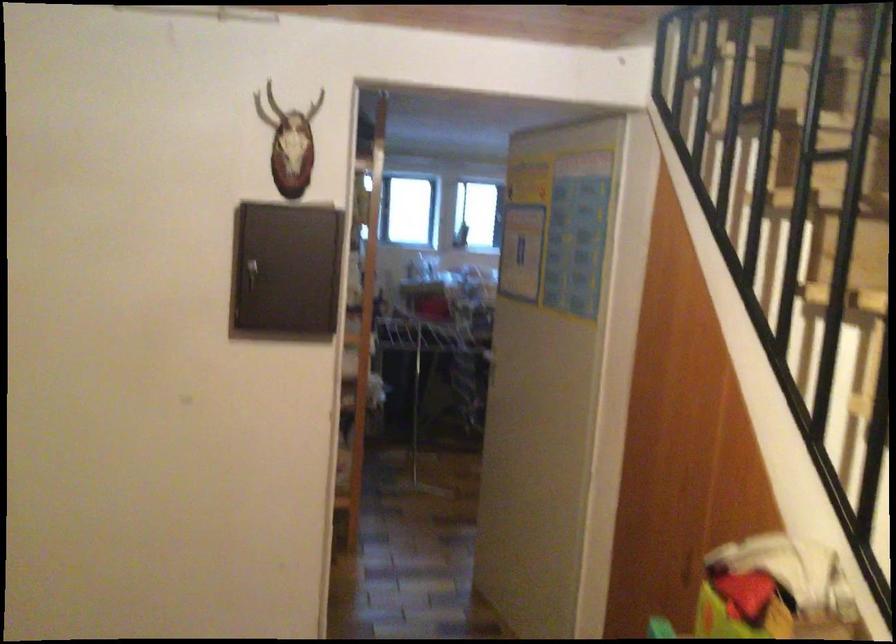
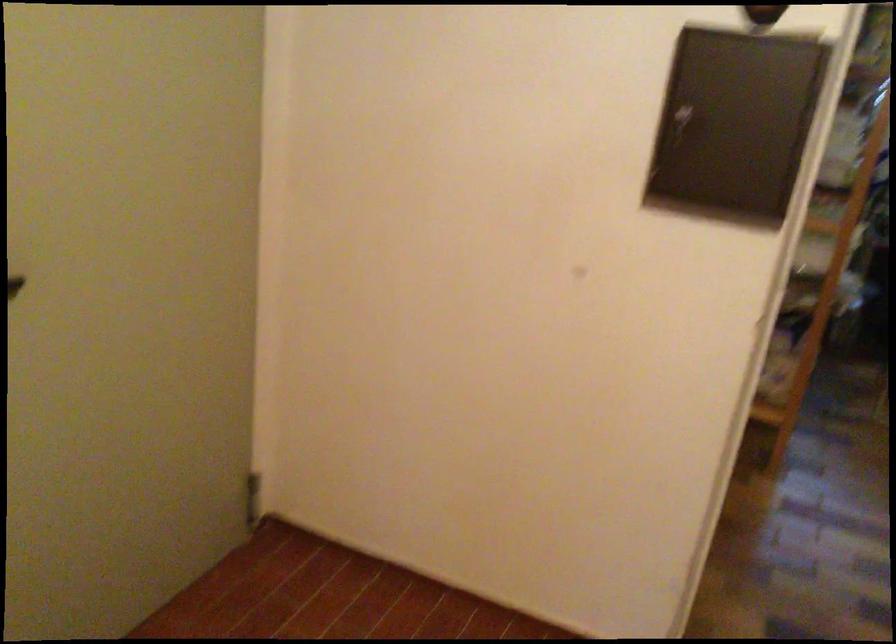
Question: The first image is from the beginning of the video and the second image is from the end. How did the camera likely rotate when shooting the video?

Choices:
 (A) Left
 (B) Right
 (C) Up
 (D) Down

Answer: (A)